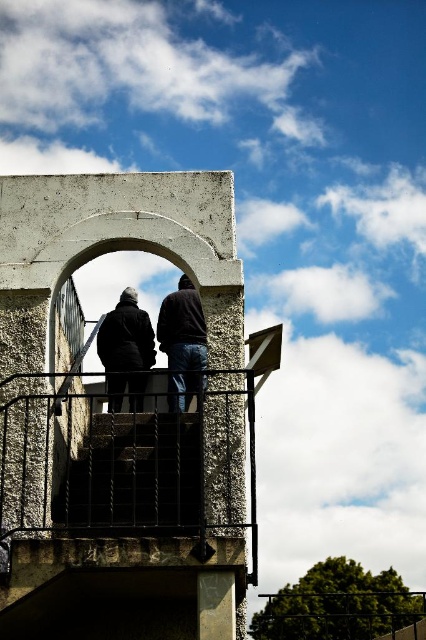
Is black metal stairwell at center smaller than dark matte jacket at center?

No.

Locate an element on the screen. The image size is (426, 640). black metal stairwell at center is located at coordinates tap(134, 474).

The image size is (426, 640). Identify the location of black metal stairwell at center. (134, 474).

Consider the image. Can you confirm if rustic concrete balcony at center is positioned to the left of dark matte jacket at center?

Incorrect, rustic concrete balcony at center is not on the left side of dark matte jacket at center.

Can you confirm if rustic concrete balcony at center is taller than dark matte jacket at center?

Correct, rustic concrete balcony at center is much taller as dark matte jacket at center.

What are the coordinates of `rustic concrete balcony at center` in the screenshot? It's located at (123, 465).

Who is more distant from viewer, (x=199, y=342) or (x=112, y=330)?

The point (x=112, y=330) is more distant.

Does dark brown leather jacket at center have a larger size compared to dark matte jacket at center?

Yes, dark brown leather jacket at center is bigger than dark matte jacket at center.

This screenshot has width=426, height=640. Identify the location of dark brown leather jacket at center. (183, 340).